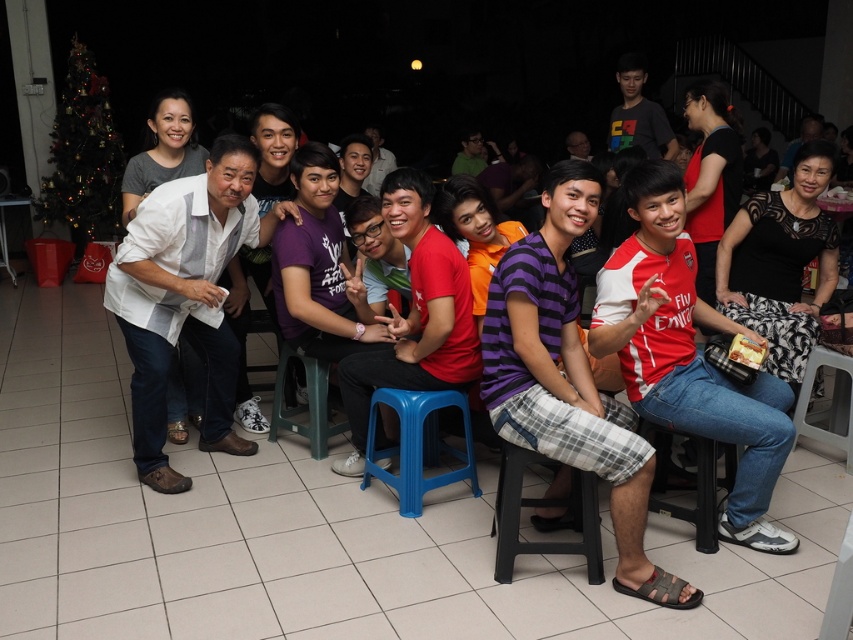
Can you confirm if blue plastic stool at center is smaller than plastic stool at lower right?

Incorrect, blue plastic stool at center is not smaller in size than plastic stool at lower right.

Can you confirm if blue plastic stool at center is shorter than plastic stool at lower right?

Correct, blue plastic stool at center is not as tall as plastic stool at lower right.

Between point (403, 417) and point (842, 358), which one is positioned behind?

The point (842, 358) is behind.

Locate an element on the screen. This screenshot has height=640, width=853. blue plastic stool at center is located at coordinates (416, 444).

Who is shorter, black plastic stool at center or plastic stool at lower right?

black plastic stool at center

Which is in front, point (503, 476) or point (837, 355)?

Point (503, 476) is more forward.

I want to click on black plastic stool at center, so click(x=543, y=506).

Is black plastic stool at lower center positioned in front of plastic stool at lower right?

Yes.

Consider the image. Which of these two, black plastic stool at lower center or plastic stool at lower right, stands taller?

Standing taller between the two is plastic stool at lower right.

The width and height of the screenshot is (853, 640). I want to click on black plastic stool at lower center, so click(x=694, y=477).